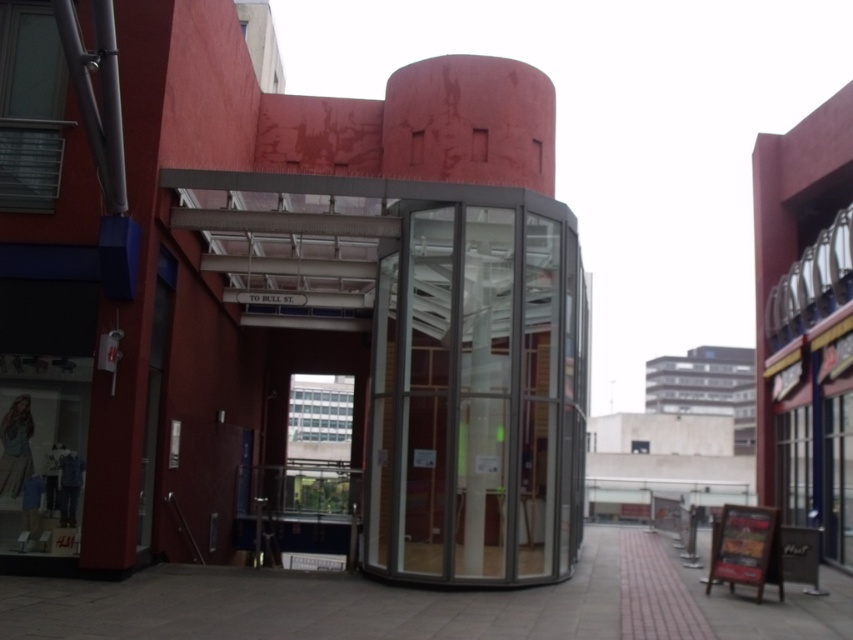
Who is more distant from viewer, (415, 451) or (550, 628)?

Positioned behind is point (415, 451).

Is transparent glass elevator at center below paved stone pavement at center?

No.

Measure the distance between transparent glass elevator at center and camera.

The distance of transparent glass elevator at center from camera is 9.68 meters.

Where is `transparent glass elevator at center`? Image resolution: width=853 pixels, height=640 pixels. transparent glass elevator at center is located at coordinates (474, 396).